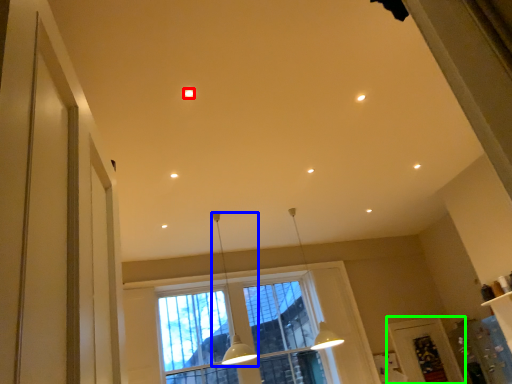
Question: Which is nearer to the lighting (highlighted by a red box)? lamp (highlighted by a blue box) or screen door (highlighted by a green box).

Choices:
 (A) lamp
 (B) screen door

Answer: (A)